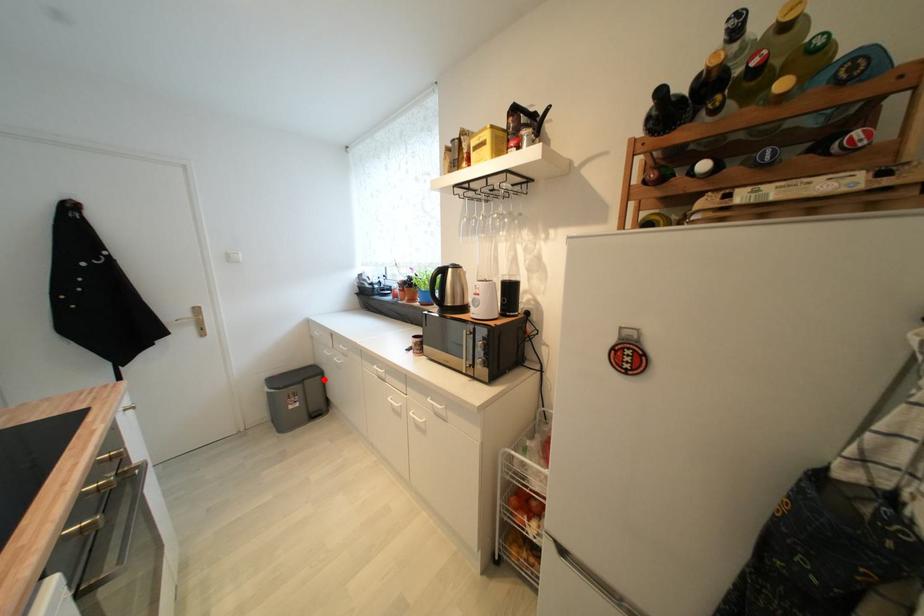
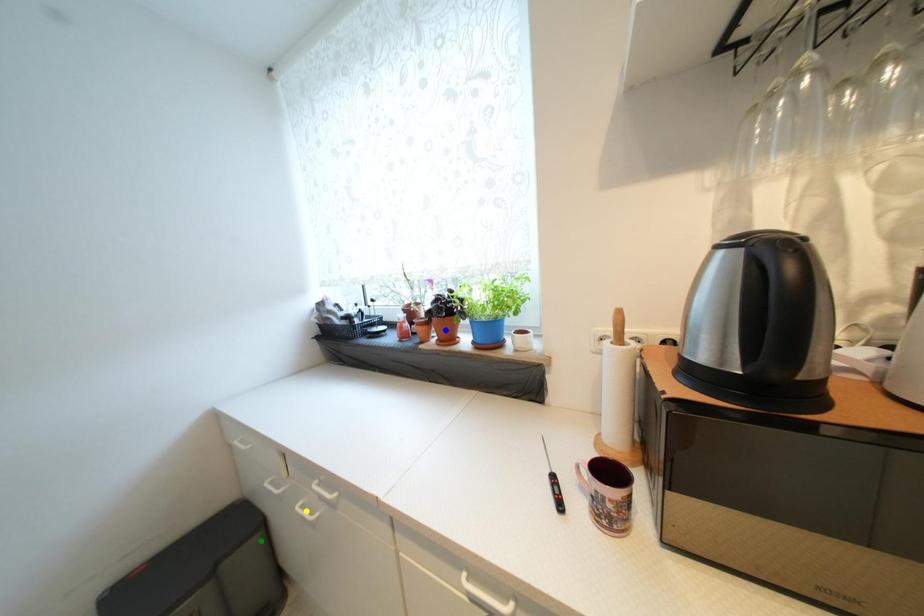
Question: I am providing you with two images of the same scene from different viewpoints. A red point is marked on the first image. You are given multiple points on the second image. Which point in image 2 represents the same 3d spot as the red point in image 1?

Choices:
 (A) yellow point
 (B) green point
 (C) blue point

Answer: (B)